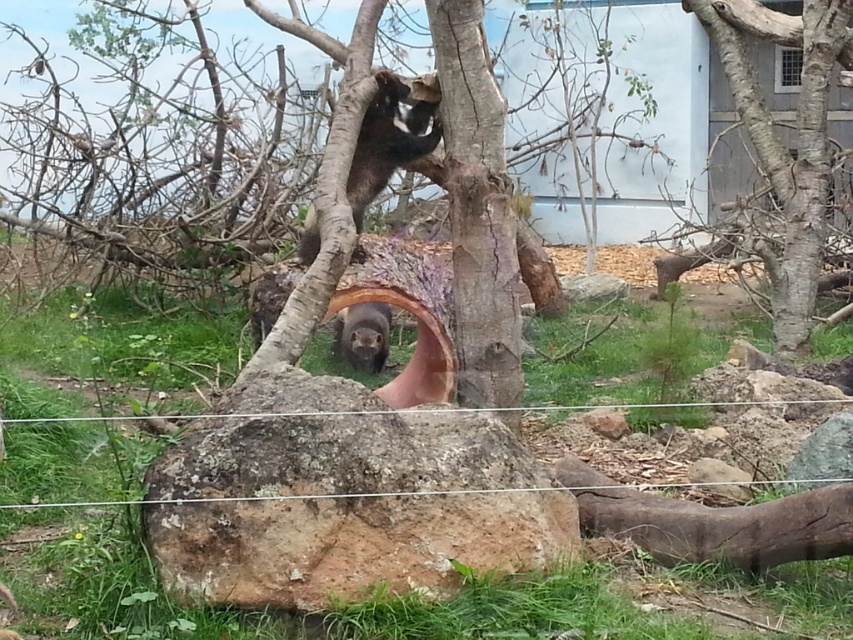
Question: Does brown rough rock at center appear under brown rough log at lower right?

Choices:
 (A) no
 (B) yes

Answer: (A)

Question: Which object is positioned closest to the wire mesh at center?

Choices:
 (A) smooth bark tree trunk at center
 (B) furry brown otter at center
 (C) brown rough tree at right
 (D) brown rough log at lower right

Answer: (D)

Question: Among these points, which one is nearest to the camera?

Choices:
 (A) (370, 312)
 (B) (693, 515)

Answer: (B)

Question: Where is brown rough tree at right located in relation to furry brown otter at center in the image?

Choices:
 (A) right
 (B) left

Answer: (A)

Question: Does brown rough rock at center come behind furry brown otter at center?

Choices:
 (A) no
 (B) yes

Answer: (A)

Question: Which of the following is the closest to the observer?

Choices:
 (A) (514, 337)
 (B) (368, 330)
 (C) (351, 580)
 (D) (796, 317)

Answer: (C)